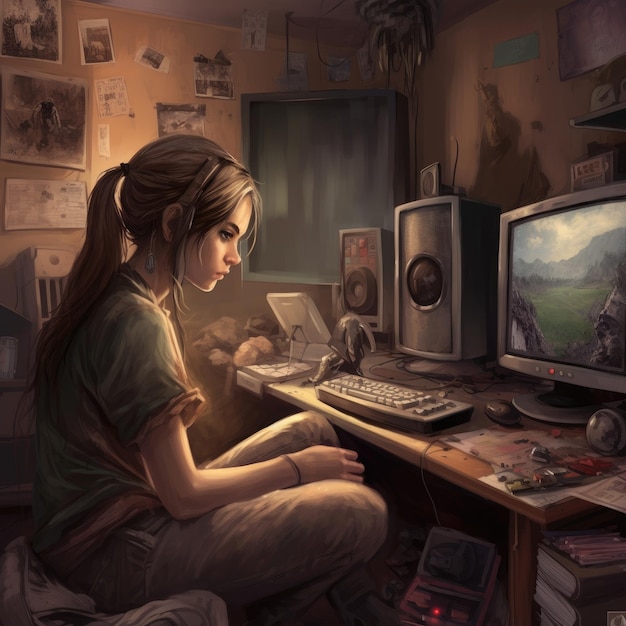
Where is `monitor`? monitor is located at coordinates (531, 326).